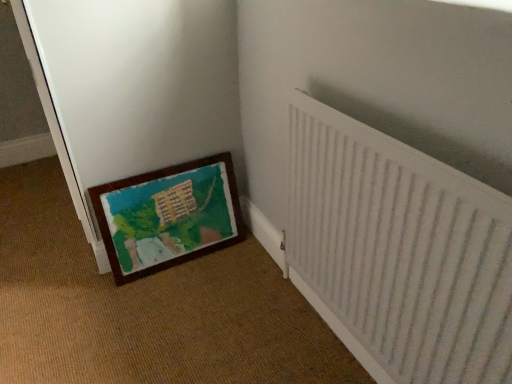
Locate an element on the screen. wooden picture frame at lower left is located at coordinates (168, 216).

What is the approximate height of white textured radiator at right?

The height of white textured radiator at right is 29.86 inches.

Find the location of `wooden picture frame at lower left`. wooden picture frame at lower left is located at coordinates (168, 216).

Considering the points (117, 57) and (457, 230), which point is behind, point (117, 57) or point (457, 230)?

The point (117, 57) is behind.

Which object is more forward, wooden painted mat at lower left or white textured radiator at right?

white textured radiator at right.

From the image's perspective, is wooden painted mat at lower left above or below white textured radiator at right?

wooden painted mat at lower left is situated higher than white textured radiator at right in the image.

Choose the correct answer: Is wooden painted mat at lower left inside white textured radiator at right or outside it?

wooden painted mat at lower left is not enclosed by white textured radiator at right.

Is the surface of wooden picture frame at lower left in direct contact with white textured radiator at right?

No, wooden picture frame at lower left is not touching white textured radiator at right.

Based on their sizes in the image, would you say wooden picture frame at lower left is bigger or smaller than white textured radiator at right?

Considering their sizes, wooden picture frame at lower left takes up less space than white textured radiator at right.

Which object is wider, wooden picture frame at lower left or white textured radiator at right?

With larger width is wooden picture frame at lower left.

Find the location of a particular element. radiator above the wooden picture frame at lower left (from a real-world perspective) is located at coordinates (400, 249).

Does white textured radiator at right have a greater width compared to wooden painted mat at lower left?

In fact, white textured radiator at right might be narrower than wooden painted mat at lower left.

Locate an element on the screen. Image resolution: width=512 pixels, height=384 pixels. screen door that is behind the white textured radiator at right is located at coordinates (134, 88).

What's the angular difference between white textured radiator at right and wooden painted mat at lower left's facing directions?

0.155 degrees.

Is white textured radiator at right positioned with its back to wooden painted mat at lower left?

That's not correct — white textured radiator at right is not looking away from wooden painted mat at lower left.

From the image's perspective, relative to wooden picture frame at lower left, is white textured radiator at right above or below?

Clearly, from the image's perspective, white textured radiator at right is below wooden picture frame at lower left.

Is white textured radiator at right at the right side of wooden picture frame at lower left?

Yes.

From a real-world perspective, is white textured radiator at right located beneath wooden picture frame at lower left?

No, from a real-world perspective, white textured radiator at right is not under wooden picture frame at lower left.

Is point (104, 175) farther from camera compared to point (238, 208)?

That is False.

Which is behind, wooden painted mat at lower left or wooden picture frame at lower left?

wooden picture frame at lower left.

Which object is positioned more to the right, wooden painted mat at lower left or wooden picture frame at lower left?

wooden picture frame at lower left is more to the right.

Is wooden painted mat at lower left next to wooden picture frame at lower left and touching it?

No, wooden painted mat at lower left is not next to wooden picture frame at lower left.

Is wooden picture frame at lower left positioned before wooden painted mat at lower left?

No, it is behind wooden painted mat at lower left.

Identify the location of screen door on the left of wooden picture frame at lower left. (134, 88).

Does wooden picture frame at lower left have a lesser height compared to wooden painted mat at lower left?

Yes.

Can wooden painted mat at lower left be found inside wooden picture frame at lower left?

That's incorrect, wooden painted mat at lower left is not inside wooden picture frame at lower left.

In order to click on radiator below the wooden painted mat at lower left (from the image's perspective) in this screenshot , I will do [x=400, y=249].

Identify the location of radiator in front of the wooden picture frame at lower left. Image resolution: width=512 pixels, height=384 pixels. (400, 249).

Based on their spatial positions, is wooden painted mat at lower left or white textured radiator at right further from wooden picture frame at lower left?

The object further to wooden picture frame at lower left is white textured radiator at right.

Estimate the real-world distances between objects in this image. Which object is further from wooden painted mat at lower left, white textured radiator at right or wooden picture frame at lower left?

white textured radiator at right.

Consider the image. Based on their spatial positions, is white textured radiator at right or wooden painted mat at lower left further from wooden picture frame at lower left?

Among the two, white textured radiator at right is located further to wooden picture frame at lower left.

From the picture: When comparing their distances from wooden painted mat at lower left, does wooden picture frame at lower left or white textured radiator at right seem further?

The object further to wooden painted mat at lower left is white textured radiator at right.

Estimate the real-world distances between objects in this image. Which object is further from white textured radiator at right, wooden painted mat at lower left or wooden picture frame at lower left?

Among the two, wooden painted mat at lower left is located further to white textured radiator at right.

Looking at the image, which one is located closer to white textured radiator at right, wooden picture frame at lower left or wooden painted mat at lower left?

wooden picture frame at lower left lies closer to white textured radiator at right than the other object.

Find the location of a particular element. The height and width of the screenshot is (384, 512). picture frame between wooden painted mat at lower left and white textured radiator at right from left to right is located at coordinates (168, 216).